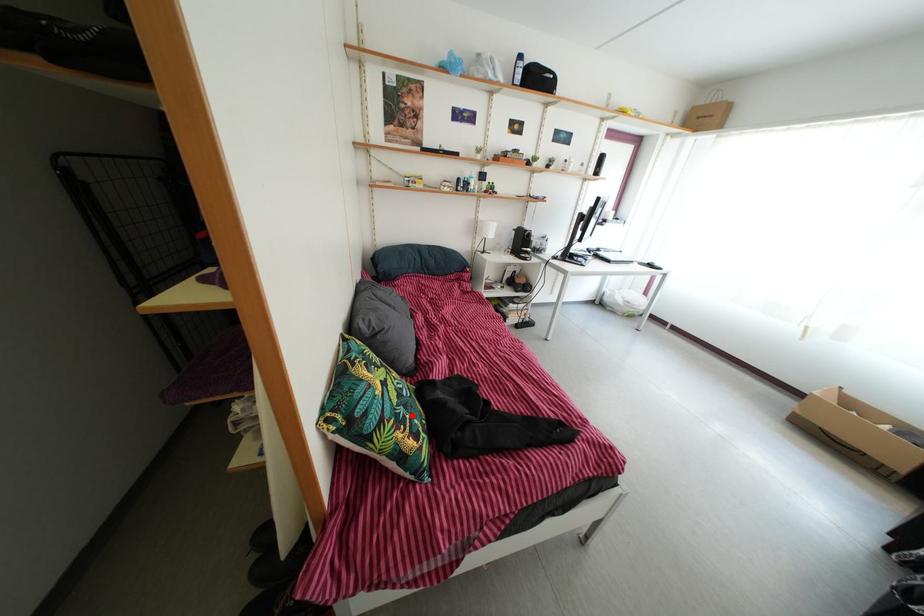
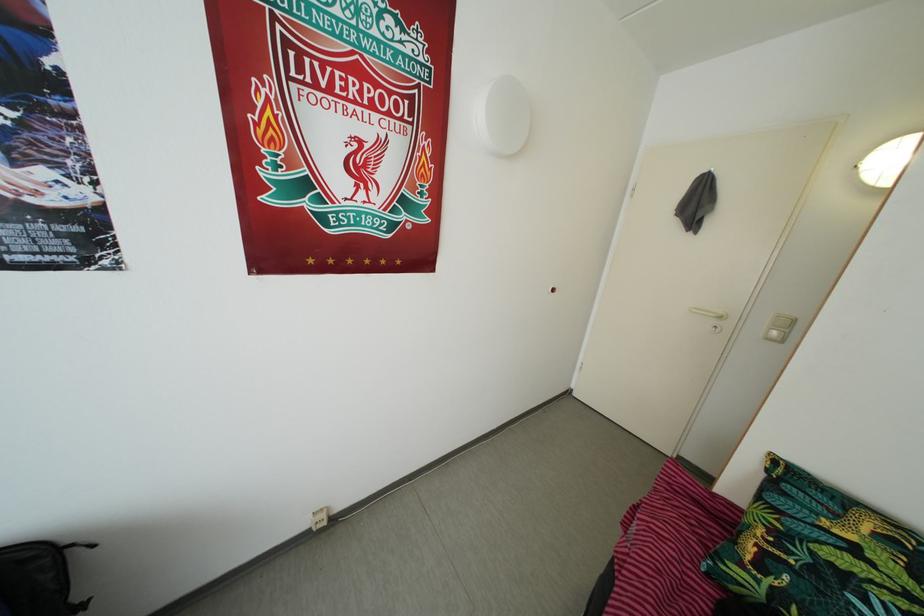
Where in the second image is the point corresponding to the highlighted location from the first image?

(820, 578)